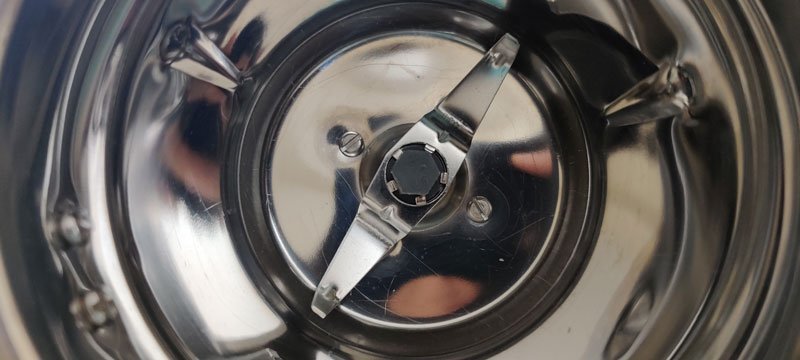
Where is `silver screws`? silver screws is located at coordinates (502, 221), (366, 153).